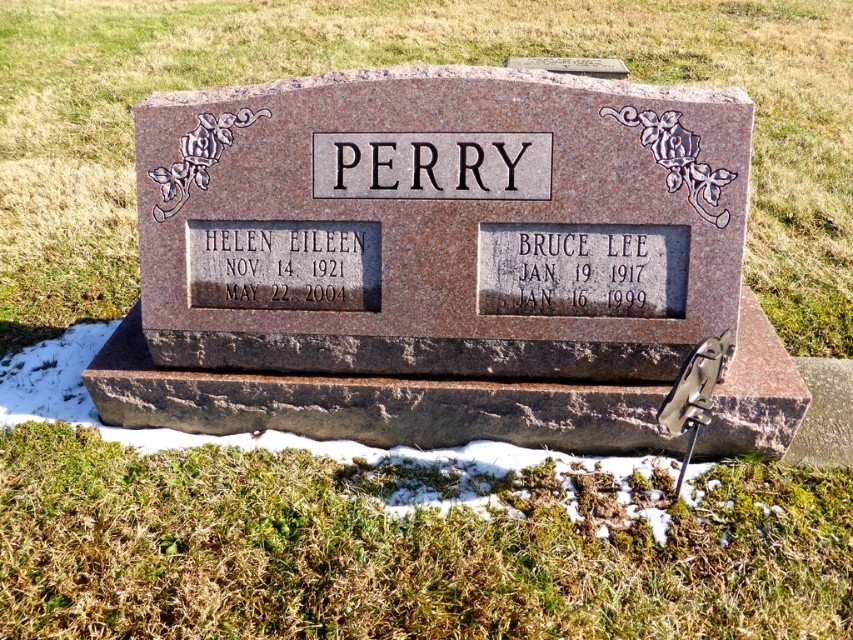
You are standing in front of the gravestone and want to place a bouquet of flowers. The bouquet requires a space wider than the black granite text at lower left. Do you think the green grass at lower center has enough space?

The green grass at lower center might be wider than black granite text at lower left, so there is a possibility that the space on the green grass at lower center is sufficient for placing the bouquet.